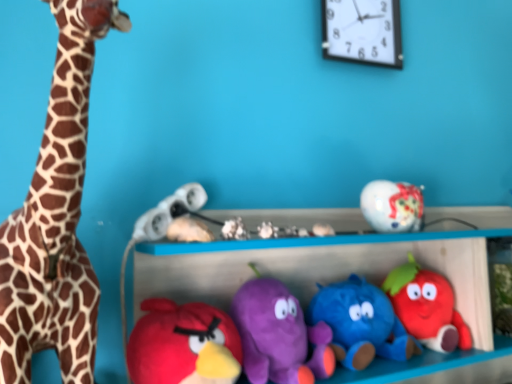
You are a GUI agent. You are given a task and a screenshot of the screen. Output one action in this format:
    pyautogui.click(x=<x>, y=<y>)
    Task: Click on the matte white toy at center, marked as the seventh toy in a left-to-right arrangement
    The image size is (512, 384).
    Given the screenshot: What is the action you would take?
    pyautogui.click(x=323, y=230)

This screenshot has height=384, width=512. What do you see at coordinates (323, 230) in the screenshot?
I see `matte white toy at center, placed as the 3th toy when sorted from right to left` at bounding box center [323, 230].

This screenshot has width=512, height=384. Identify the location of spotted fur giraffe at left. (56, 217).

The width and height of the screenshot is (512, 384). What are the coordinates of `matte white toy at center, placed as the 3th toy when sorted from right to left` in the screenshot? It's located at (323, 230).

From a real-world perspective, is spotted fur giraffe at left positioned over matte white toy at center, marked as the seventh toy in a left-to-right arrangement, based on gravity?

Correct, in the physical world, spotted fur giraffe at left is higher than matte white toy at center, marked as the seventh toy in a left-to-right arrangement.

Looking at their sizes, would you say spotted fur giraffe at left is wider or thinner than matte white toy at center, marked as the seventh toy in a left-to-right arrangement?

Considering their sizes, spotted fur giraffe at left looks broader than matte white toy at center, marked as the seventh toy in a left-to-right arrangement.

At what (x,y) coordinates should I click in order to perform the action: click on giraffe above the matte white toy at center, placed as the 3th toy when sorted from right to left (from the image's perspective). Please return your answer as a coordinate pair (x, y). The image size is (512, 384). Looking at the image, I should click on (56, 217).

Which object is more forward, spotted fur giraffe at left or matte white toy at center, marked as the seventh toy in a left-to-right arrangement?

spotted fur giraffe at left is more forward.

From a real-world perspective, is purple plush toy at center, positioned as the sixth toy in left-to-right order, physically below matte white toy at center, placed as the 3th toy when sorted from right to left?

Yes, from a real-world perspective, purple plush toy at center, positioned as the sixth toy in left-to-right order, is beneath matte white toy at center, placed as the 3th toy when sorted from right to left.

Is purple plush toy at center, the fourth toy viewed from the right, looking in the opposite direction of matte white toy at center, marked as the seventh toy in a left-to-right arrangement?

purple plush toy at center, the fourth toy viewed from the right, is not turned away from matte white toy at center, marked as the seventh toy in a left-to-right arrangement.

Considering their positions, is purple plush toy at center, the fourth toy viewed from the right, located in front of or behind matte white toy at center, marked as the seventh toy in a left-to-right arrangement?

Visually, purple plush toy at center, the fourth toy viewed from the right, is located in front of matte white toy at center, marked as the seventh toy in a left-to-right arrangement.

Is matte white toy at center, placed as the 3th toy when sorted from right to left, located within purple plush toy at center, positioned as the sixth toy in left-to-right order?

Definitely not — matte white toy at center, placed as the 3th toy when sorted from right to left, is not inside purple plush toy at center, positioned as the sixth toy in left-to-right order.

Is spotted fur giraffe at left thinner than soft plush strawberry at center right, the 1th toy viewed from the right?

Incorrect, the width of spotted fur giraffe at left is not less than that of soft plush strawberry at center right, the 1th toy viewed from the right.

From a real-world perspective, is spotted fur giraffe at left over soft plush strawberry at center right, the 1th toy viewed from the right?

Yes, from a real-world perspective, spotted fur giraffe at left is on top of soft plush strawberry at center right, the 1th toy viewed from the right.

Is spotted fur giraffe at left turned away from soft plush strawberry at center right, which ranks as the ninth toy in left-to-right order?

No, soft plush strawberry at center right, which ranks as the ninth toy in left-to-right order, is not at the back of spotted fur giraffe at left.

Which is more to the left, white plastic clock at upper center or matte white toy at center, which ranks as the 8th toy in right-to-left order?

matte white toy at center, which ranks as the 8th toy in right-to-left order.

Is white plastic clock at upper center closer to camera compared to matte white toy at center, which ranks as the 8th toy in right-to-left order?

No, white plastic clock at upper center is further to the viewer.

Is white plastic clock at upper center oriented towards matte white toy at center, which ranks as the 8th toy in right-to-left order?

No, white plastic clock at upper center is not aimed at matte white toy at center, which ranks as the 8th toy in right-to-left order.

Looking at the image, does white plastic clock at upper center seem bigger or smaller compared to matte white toy at center, which ranks as the second toy in left-to-right order?

In the image, white plastic clock at upper center appears to be larger than matte white toy at center, which ranks as the second toy in left-to-right order.

Consider the image. From the image's perspective, which is above, white plastic clock at upper center or spotted fur giraffe at left?

white plastic clock at upper center is shown above in the image.

Would you say white plastic clock at upper center is outside spotted fur giraffe at left?

Yes, white plastic clock at upper center is not within spotted fur giraffe at left.

At what (x,y) coordinates should I click in order to perform the action: click on giraffe that appears below the white plastic clock at upper center (from the image's perspective). Please return your answer as a coordinate pair (x, y). The image size is (512, 384). Looking at the image, I should click on (56, 217).

Is white matte seashell at center, which appears as the fifth toy when viewed from the right, surrounded by blue plush toy at center, arranged as the eighth toy when viewed from the left?

No.

Is blue plush toy at center, positioned as the second toy in right-to-left order, placed right next to white matte seashell at center, which appears as the fifth toy when viewed from the right?

No, blue plush toy at center, positioned as the second toy in right-to-left order, is not with white matte seashell at center, which appears as the fifth toy when viewed from the right.

Between blue plush toy at center, arranged as the eighth toy when viewed from the left, and white matte seashell at center, which appears as the fifth toy when viewed from the right, which one has smaller size?

Smaller between the two is white matte seashell at center, which appears as the fifth toy when viewed from the right.

Is white matte seashell at center, which appears as the fifth toy when viewed from the right, at the back of blue plush toy at center, positioned as the second toy in right-to-left order?

No, blue plush toy at center, positioned as the second toy in right-to-left order, is not facing away from white matte seashell at center, which appears as the fifth toy when viewed from the right.

Are velvet plush bird at lower left, arranged as the seventh toy when viewed from the right, and matte white toy at center, placed as the 3th toy when sorted from right to left, making contact?

No, velvet plush bird at lower left, arranged as the seventh toy when viewed from the right, is not making contact with matte white toy at center, placed as the 3th toy when sorted from right to left.

Considering the relative sizes of velvet plush bird at lower left, marked as the third toy in a left-to-right arrangement, and matte white toy at center, placed as the 3th toy when sorted from right to left, in the image provided, is velvet plush bird at lower left, marked as the third toy in a left-to-right arrangement, taller than matte white toy at center, placed as the 3th toy when sorted from right to left,?

Indeed, velvet plush bird at lower left, marked as the third toy in a left-to-right arrangement, has a greater height compared to matte white toy at center, placed as the 3th toy when sorted from right to left.

Is velvet plush bird at lower left, arranged as the seventh toy when viewed from the right, facing away from matte white toy at center, marked as the seventh toy in a left-to-right arrangement?

velvet plush bird at lower left, arranged as the seventh toy when viewed from the right, is not turned away from matte white toy at center, marked as the seventh toy in a left-to-right arrangement.

Locate an element on the screen. The width and height of the screenshot is (512, 384). toy that is the 7th one when counting backward from the spotted fur giraffe at left is located at coordinates (323, 230).

This screenshot has width=512, height=384. Find the location of `the 2nd toy below the matte white toy at center, marked as the seventh toy in a left-to-right arrangement (from the image's perspective)`. the 2nd toy below the matte white toy at center, marked as the seventh toy in a left-to-right arrangement (from the image's perspective) is located at coordinates (279, 335).

Based on their spatial positions, is white plastic clock at upper center or blue plush toy at center, arranged as the eighth toy when viewed from the left, further from spotted fur giraffe at left?

white plastic clock at upper center.

Based on their spatial positions, is matte white toy at center, which ranks as the 8th toy in right-to-left order, or soft plush strawberry at center right, which ranks as the ninth toy in left-to-right order, further from spotted fur giraffe at left?

soft plush strawberry at center right, which ranks as the ninth toy in left-to-right order, lies further to spotted fur giraffe at left than the other object.

Considering their positions, is matte white toy at center, which ranks as the second toy in left-to-right order, positioned closer to velvet plush bird at lower left, arranged as the seventh toy when viewed from the right, than white plush toy at center, marked as the sixth toy in a right-to-left arrangement?

matte white toy at center, which ranks as the second toy in left-to-right order, is closer to velvet plush bird at lower left, arranged as the seventh toy when viewed from the right.

Looking at the image, which one is located further to white matte seashell at center, which appears as the fifth toy when viewed from the right, matte white toy at center, placed as the 3th toy when sorted from right to left, or white plush toy at center, marked as the sixth toy in a right-to-left arrangement?

matte white toy at center, placed as the 3th toy when sorted from right to left, is further to white matte seashell at center, which appears as the fifth toy when viewed from the right.

When comparing their distances from velvet plush bird at lower left, arranged as the seventh toy when viewed from the right, does purple plush toy at center, positioned as the sixth toy in left-to-right order, or spotted fur giraffe at left seem further?

spotted fur giraffe at left lies further to velvet plush bird at lower left, arranged as the seventh toy when viewed from the right, than the other object.

From the image, which object appears to be nearer to white matte seashell at center, which appears as the fifth toy when viewed from the right, velvet plush bird at lower left, arranged as the seventh toy when viewed from the right, or purple plush toy at center, positioned as the sixth toy in left-to-right order?

purple plush toy at center, positioned as the sixth toy in left-to-right order, lies closer to white matte seashell at center, which appears as the fifth toy when viewed from the right, than the other object.

Based on their spatial positions, is soft plush strawberry at center right, which ranks as the ninth toy in left-to-right order, or white plush toy at center, the fourth toy in the left-to-right sequence, closer to white matte headphones at center, placed as the ninth toy when sorted from right to left?

white plush toy at center, the fourth toy in the left-to-right sequence, is closer to white matte headphones at center, placed as the ninth toy when sorted from right to left.

When comparing their distances from soft plush strawberry at center right, the 1th toy viewed from the right, does white plastic clock at upper center or white matte seashell at center, the 5th toy from the left, seem closer?

white matte seashell at center, the 5th toy from the left, is closer to soft plush strawberry at center right, the 1th toy viewed from the right.

Locate an element on the screen. This screenshot has height=384, width=512. toy between matte white toy at center, marked as the seventh toy in a left-to-right arrangement, and soft plush strawberry at center right, the 1th toy viewed from the right, in the horizontal direction is located at coordinates (361, 323).

This screenshot has width=512, height=384. I want to click on giraffe between white plastic clock at upper center and velvet plush bird at lower left, arranged as the seventh toy when viewed from the right, vertically, so click(56, 217).

Identify the location of giraffe between white plastic clock at upper center and purple plush toy at center, the fourth toy viewed from the right, vertically. [x=56, y=217].

Where is `clock between spotted fur giraffe at left and soft plush strawberry at center right, which ranks as the ninth toy in left-to-right order`? clock between spotted fur giraffe at left and soft plush strawberry at center right, which ranks as the ninth toy in left-to-right order is located at coordinates (362, 31).